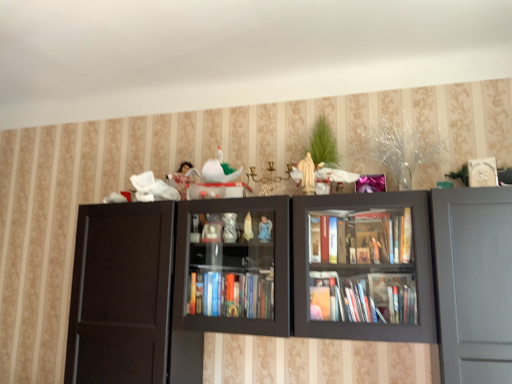
Measure the distance between dark wood bookcase at center and camera.

5.37 feet.

Describe the element at coordinates (159, 296) in the screenshot. I see `dark wood bookcase at center` at that location.

You are a GUI agent. You are given a task and a screenshot of the screen. Output one action in this format:
    pyautogui.click(x=<x>, y=<y>)
    Task: Click on the dark wood bookcase at center
    This screenshot has height=384, width=512.
    Given the screenshot: What is the action you would take?
    pyautogui.click(x=159, y=296)

At what (x,y) coordinates should I click in order to perform the action: click on dark wood bookcase at center. Please return your answer as a coordinate pair (x, y). The image size is (512, 384). Looking at the image, I should click on (159, 296).